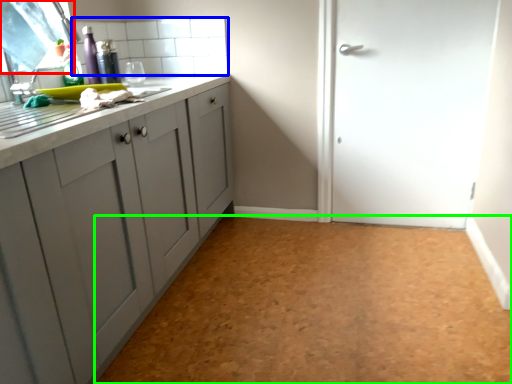
Question: Which is nearer to the window screen (highlighted by a red box)? tile (highlighted by a blue box) or plain (highlighted by a green box).

Choices:
 (A) tile
 (B) plain

Answer: (A)